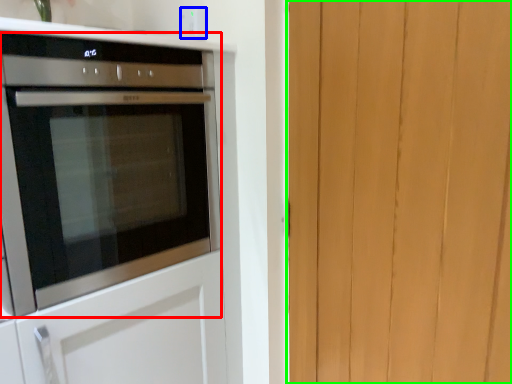
Question: Which is farther away from oven (highlighted by a red box)? electric outlet (highlighted by a blue box) or barn door (highlighted by a green box)?

Choices:
 (A) electric outlet
 (B) barn door

Answer: (B)